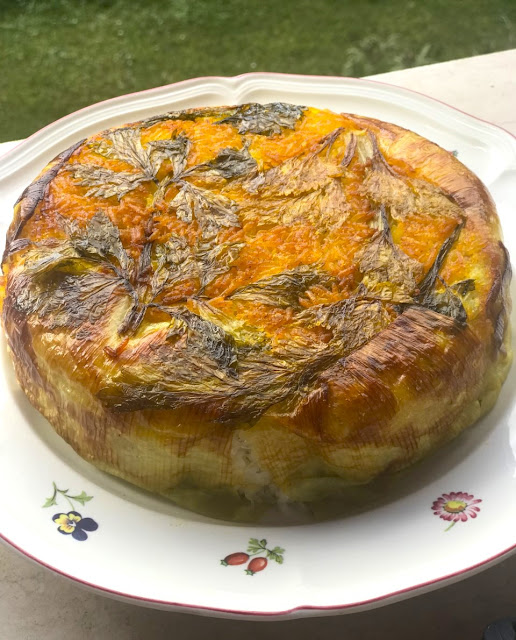
Locate an element on the screen. The image size is (516, 640). platter is located at coordinates (116, 546).